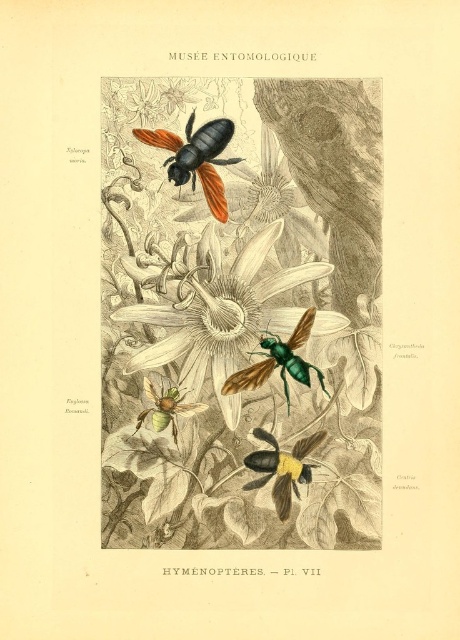
Is shiny black beetle at upper center taller than green matte bee at center?

Yes, shiny black beetle at upper center is taller than green matte bee at center.

From the picture: Between shiny black beetle at upper center and green matte bee at center, which one is positioned higher?

shiny black beetle at upper center is higher up.

Is point (201, 172) in front of point (180, 401)?

That is True.

Find the location of a particular element. The image size is (460, 640). shiny black beetle at upper center is located at coordinates (x=195, y=157).

Who is more distant from viewer, (253,460) or (174,406)?

The point (174,406) is more distant.

Who is more distant from viewer, [280,460] or [184,410]?

The point [184,410] is behind.

The height and width of the screenshot is (640, 460). In order to click on yellow-brown fuzzy bee at center in this screenshot , I will do `click(281, 467)`.

Can you confirm if matte black bee at upper center is bigger than metallic green bee at center?

Indeed, matte black bee at upper center has a larger size compared to metallic green bee at center.

Between point (292, 422) and point (276, 337), which one is positioned behind?

The point (276, 337) is behind.

This screenshot has width=460, height=640. What are the coordinates of `matte black bee at upper center` in the screenshot? It's located at (241, 310).